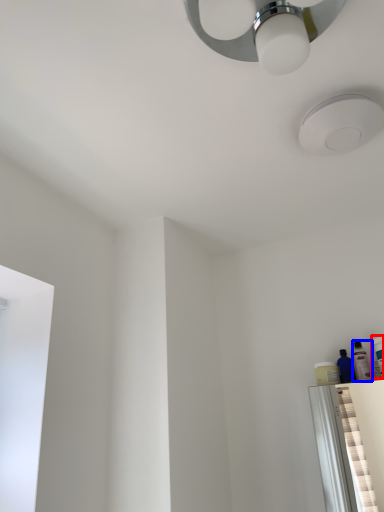
Question: Which point is further to the camera, toiletry (highlighted by a red box) or toiletry (highlighted by a blue box)?

Choices:
 (A) toiletry
 (B) toiletry

Answer: (B)